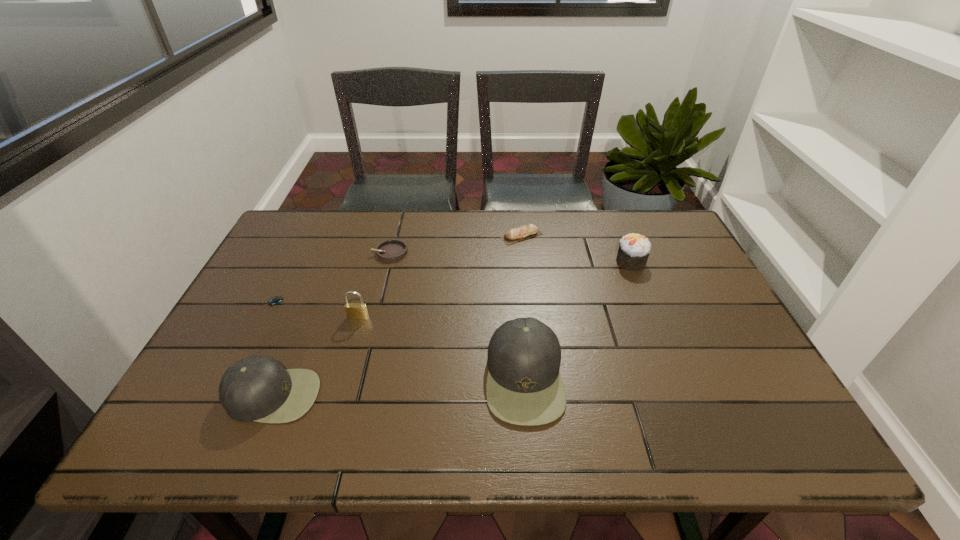
Where is `object that is the closest to the shortest object`? object that is the closest to the shortest object is located at coordinates (256, 388).

Identify which object is the fifth closest to the fourth nearest object. Please provide its 2D coordinates. Your answer should be formatted as a tuple, i.e. [(x, y)], where the tuple contains the x and y coordinates of a point satisfying the conditions above.

[(520, 233)]

In order to click on vacant space that satisfies the following two spatial constraints: 1. on the back side of the shortest object; 2. on the left side of the cupcake in this screenshot , I will do `click(288, 262)`.

Identify the location of vacant space that satisfies the following two spatial constraints: 1. on the back side of the mouse; 2. on the left side of the pita bread. (302, 235).